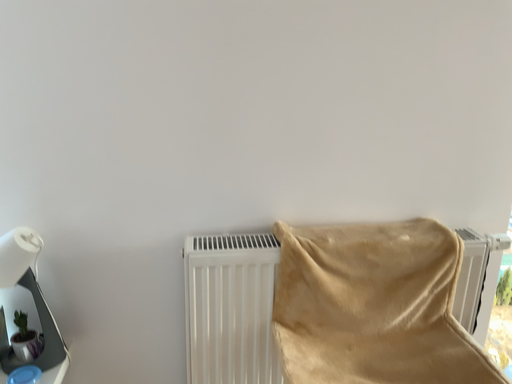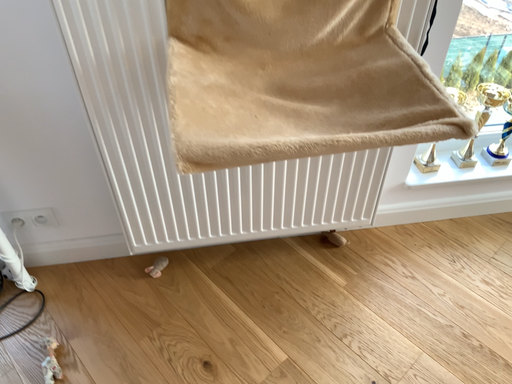
Question: How did the camera likely rotate when shooting the video?

Choices:
 (A) rotated downward
 (B) rotated upward

Answer: (A)